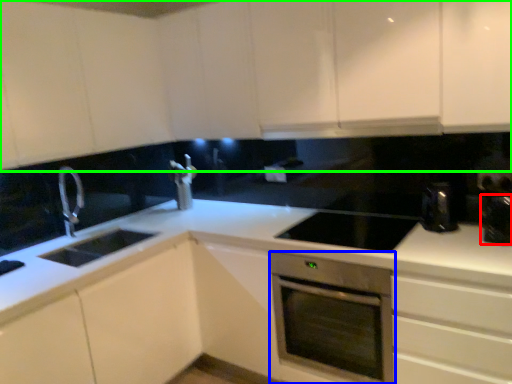
Question: Based on their relative distances, which object is nearer to appliance (highlighted by a red box)? Choose from home appliance (highlighted by a blue box) and cabinetry (highlighted by a green box).

Choices:
 (A) home appliance
 (B) cabinetry

Answer: (A)